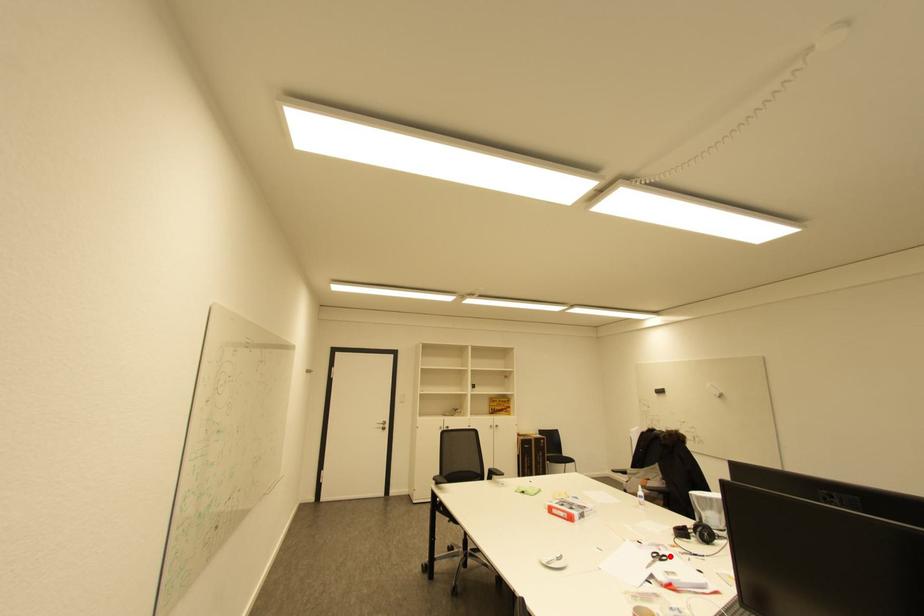
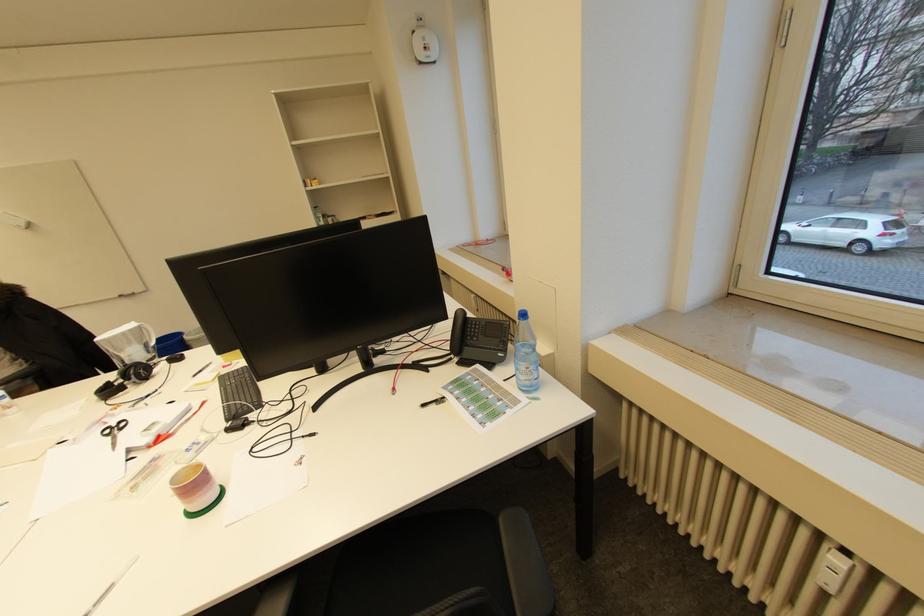
The point at the highlighted location is marked in the first image. Where is the corresponding point in the second image?

(127, 422)